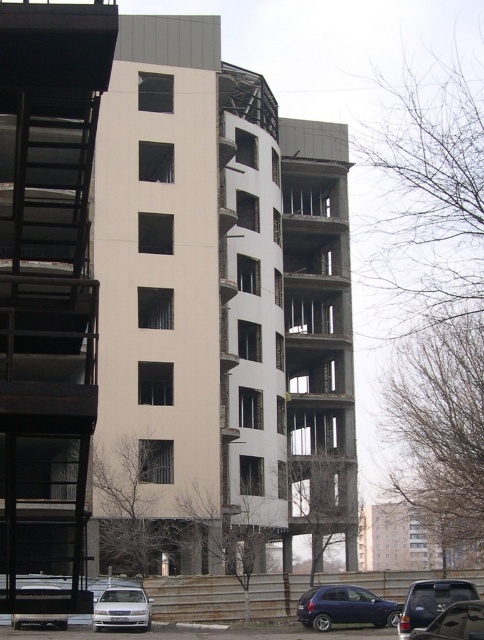
Can you confirm if metallic blue hatchback at lower center is wider than silver metallic car at lower left?

Incorrect, metallic blue hatchback at lower center's width does not surpass silver metallic car at lower left's.

Who is positioned more to the left, metallic blue hatchback at lower center or silver metallic car at lower left?

silver metallic car at lower left is more to the left.

At what (x,y) coordinates should I click in order to perform the action: click on metallic blue hatchback at lower center. Please return your answer as a coordinate pair (x, y). The width and height of the screenshot is (484, 640). Looking at the image, I should click on (345, 608).

Is white matte sedan at lower left taller than silver metallic car at lower left?

No.

Is white matte sedan at lower left to the left of silver metallic car at lower left from the viewer's perspective?

In fact, white matte sedan at lower left is to the right of silver metallic car at lower left.

Is point (127, 592) in front of point (18, 616)?

No, it is not.

Locate an element on the screen. white matte sedan at lower left is located at coordinates (121, 609).

Who is taller, black metal fire escape at left or metallic blue hatchback at lower center?

With more height is black metal fire escape at left.

Identify the location of black metal fire escape at left. (47, 289).